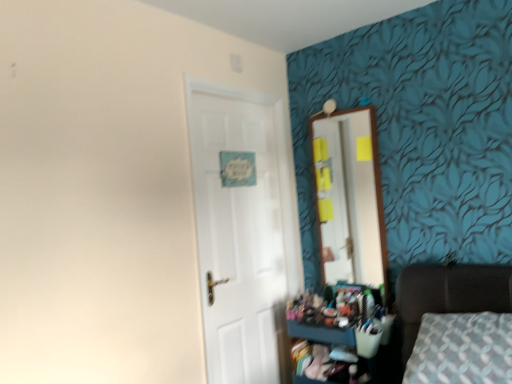
Question: Would you say dark brown leather bed at lower right is inside or outside white glossy door at center?

Choices:
 (A) outside
 (B) inside

Answer: (A)

Question: Does point (429, 292) appear closer or farther from the camera than point (193, 183)?

Choices:
 (A) closer
 (B) farther

Answer: (A)

Question: Which object is the closest to the wooden mirror at upper right?

Choices:
 (A) white glossy door at center
 (B) dark brown leather bed at lower right
 (C) wooden dresser at lower right

Answer: (A)

Question: Which is nearer to the dark brown leather bed at lower right?

Choices:
 (A) wooden mirror at upper right
 (B) wooden dresser at lower right
 (C) white glossy door at center

Answer: (B)